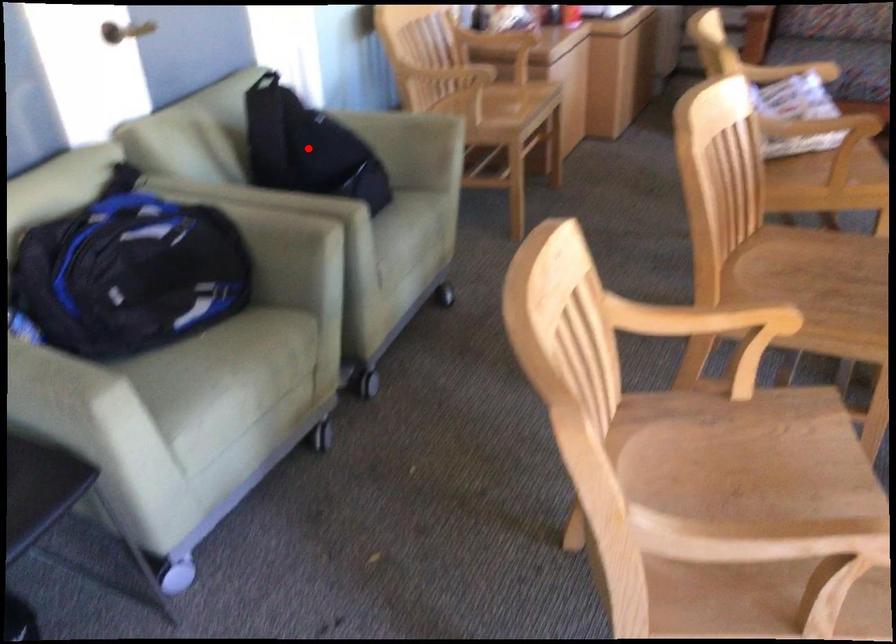
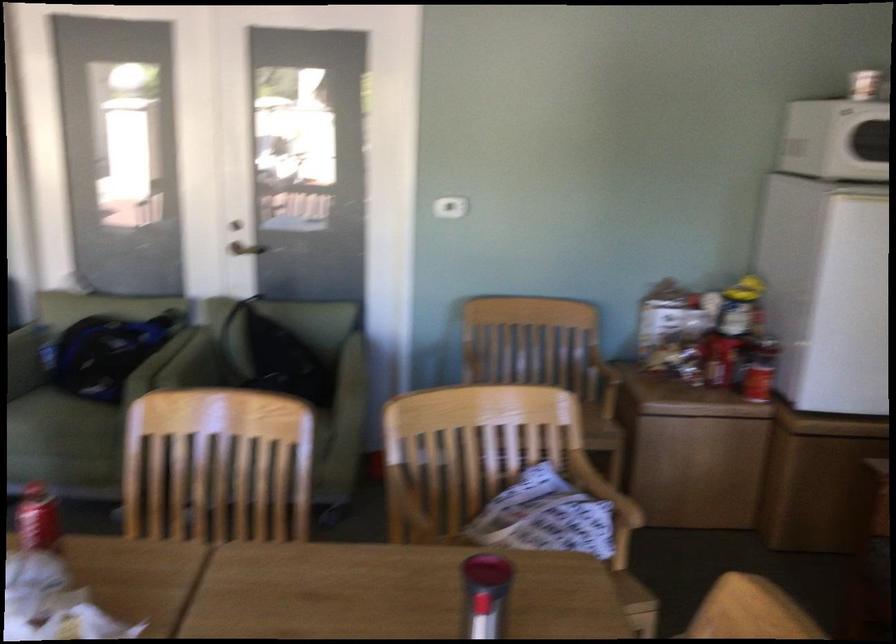
Question: I am providing you with two images of the same scene from different viewpoints. A red point is marked on the first image. Is the red point's position out of view in image 2?

Choices:
 (A) Yes
 (B) No

Answer: (A)